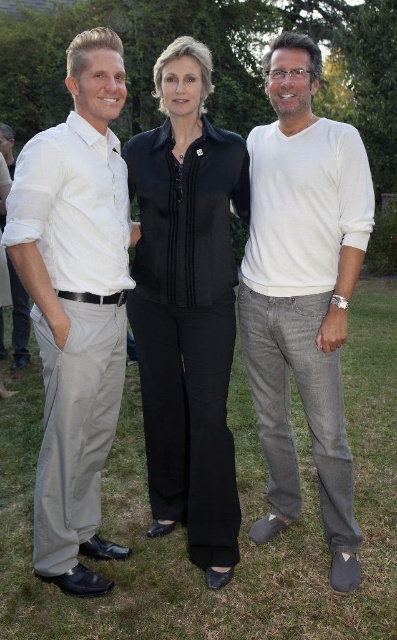
You are standing at the point labeled point (300,124) and want to walk to the point labeled point (25,269). Which direction should you move relative to your current position?

You should move forward because point (25,269) is in front of point (300,124).

You are organizing a clothing rack and need to arrange the black satin blouse at center and the white cotton sweater at center vertically. Which clothing item should be placed higher on the rack to ensure both are visible?

The black satin blouse at center should be placed higher on the rack since it has a greater height compared to the white cotton sweater at center, allowing both items to be visible.

You are organizing a clothing display and need to arrange the black satin blouse at center and the white cotton sweater at center according to their positions in the image. Which one should be placed to the left?

The black satin blouse at center should be placed to the left of the white cotton sweater at center because it is positioned on the left side of it in the image.